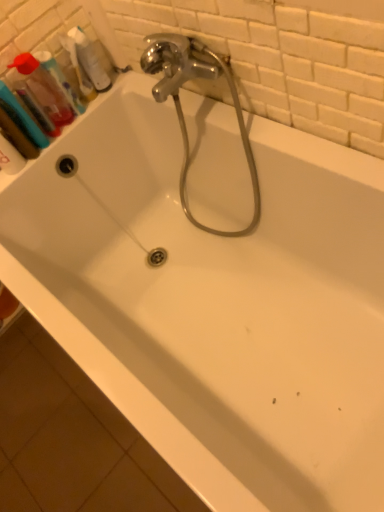
Question: Would you say translucent plastic bottle at upper left is a long distance from translucent plastic mouthwash at upper left, which is counted as the 2th mouthwash, starting from the left?

Choices:
 (A) yes
 (B) no

Answer: (B)

Question: Is translucent plastic mouthwash at upper left, the second mouthwash from the right, a part of translucent plastic bottle at upper left?

Choices:
 (A) yes
 (B) no

Answer: (B)

Question: Is translucent plastic bottle at upper left taller than translucent plastic mouthwash at upper left, which is counted as the 2th mouthwash, starting from the left?

Choices:
 (A) no
 (B) yes

Answer: (A)

Question: Does translucent plastic bottle at upper left have a greater width compared to translucent plastic mouthwash at upper left, which is counted as the 2th mouthwash, starting from the left?

Choices:
 (A) yes
 (B) no

Answer: (B)

Question: From the image's perspective, would you say translucent plastic bottle at upper left is shown under translucent plastic mouthwash at upper left, the second mouthwash from the right?

Choices:
 (A) no
 (B) yes

Answer: (A)

Question: Is translucent plastic bottle at upper left to the right of translucent plastic mouthwash at upper left, the second mouthwash from the right, from the viewer's perspective?

Choices:
 (A) no
 (B) yes

Answer: (B)

Question: From the image's perspective, is translucent plastic mouthwash at upper left, which ranks as the third mouthwash in left-to-right order, located beneath translucent plastic mouthwash at upper left, which is counted as the 2th mouthwash, starting from the left?

Choices:
 (A) no
 (B) yes

Answer: (A)

Question: Would you say translucent plastic mouthwash at upper left, positioned as the 1th mouthwash in right-to-left order, contains translucent plastic mouthwash at upper left, the second mouthwash from the right?

Choices:
 (A) no
 (B) yes

Answer: (A)

Question: Considering the relative sizes of translucent plastic mouthwash at upper left, positioned as the 1th mouthwash in right-to-left order, and translucent plastic mouthwash at upper left, the second mouthwash from the right, in the image provided, is translucent plastic mouthwash at upper left, positioned as the 1th mouthwash in right-to-left order, smaller than translucent plastic mouthwash at upper left, the second mouthwash from the right,?

Choices:
 (A) no
 (B) yes

Answer: (B)

Question: Can you confirm if translucent plastic mouthwash at upper left, which ranks as the third mouthwash in left-to-right order, is positioned to the left of translucent plastic mouthwash at upper left, which is counted as the 2th mouthwash, starting from the left?

Choices:
 (A) yes
 (B) no

Answer: (B)

Question: Considering the relative sizes of translucent plastic mouthwash at upper left, which ranks as the third mouthwash in left-to-right order, and translucent plastic mouthwash at upper left, which is counted as the 2th mouthwash, starting from the left, in the image provided, is translucent plastic mouthwash at upper left, which ranks as the third mouthwash in left-to-right order, taller than translucent plastic mouthwash at upper left, which is counted as the 2th mouthwash, starting from the left,?

Choices:
 (A) yes
 (B) no

Answer: (B)

Question: Is translucent plastic mouthwash at upper left, which ranks as the third mouthwash in left-to-right order, closer to camera compared to translucent plastic mouthwash at upper left, which is counted as the 2th mouthwash, starting from the left?

Choices:
 (A) no
 (B) yes

Answer: (A)

Question: Does translucent plastic bottle at upper left have a smaller size compared to translucent plastic mouthwash at upper left, which ranks as the 1th mouthwash in left-to-right order?

Choices:
 (A) yes
 (B) no

Answer: (A)